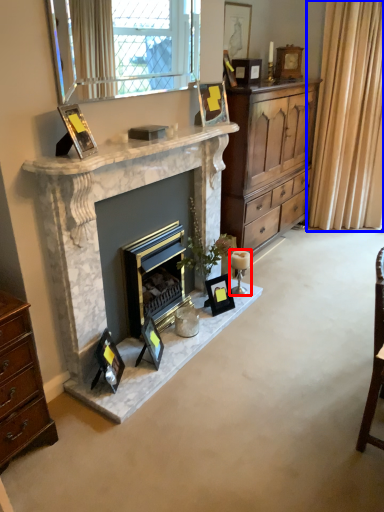
Question: Which point is further to the camera, candle holder (highlighted by a red box) or curtain (highlighted by a blue box)?

Choices:
 (A) candle holder
 (B) curtain

Answer: (B)